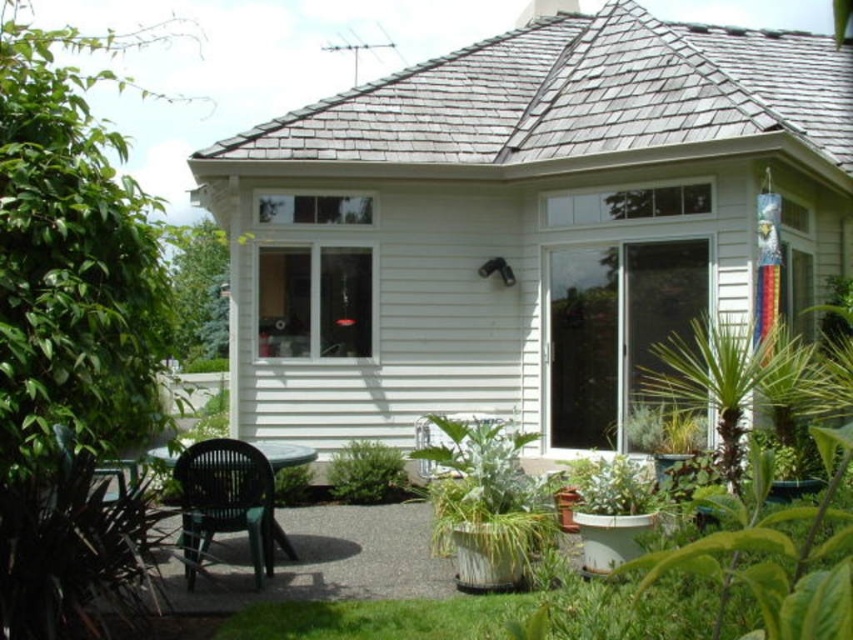
You are planning to place a new decorative item on the patio. The green metallic pot at lower center and the green leafy plant at center are already there. Which object would you choose to place the new item next to if you want it to be more noticeable?

The green metallic pot at lower center is larger in size, so placing the new item next to it would make it more noticeable.

You are planning to place a new bench that is 1.8 meters long in the patio area. Given the current arrangement of the green metallic pot at lower center and the green leafy plant at lower center, is there enough space between them to fit the bench without moving any existing items?

The distance between the green metallic pot at lower center and the green leafy plant at lower center is 2.25 meters. Since the bench is 1.8 meters long, there is sufficient space to place it between them without moving any existing items.

You are standing on the patio in front of the house and want to place a new potted plant between the green leafy plant at center and the green leafy plant at lower center. Based on their positions, where should you place the new potted plant?

The green leafy plant at center is to the right of green leafy plant at lower center, so you should place the new potted plant between them by positioning it to the right of the green leafy plant at lower center and to the left of the green leafy plant at center.